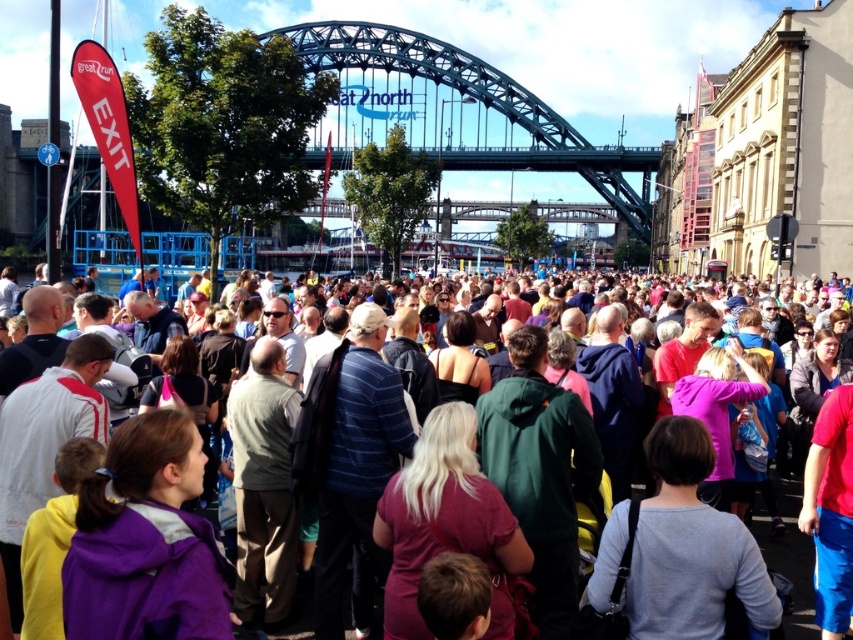
You are a photographer positioned at the edge of the event area. You want to take a photo that includes both the green steel bridge at center and the multicolored clothing at center. Which object should you focus on first to ensure both are in frame?

The green steel bridge at center is further to the viewer than the multicolored clothing at center, so you should focus on the multicolored clothing at center first to ensure both are in frame.

You are standing at the starting line of the Great North Run event and see the green steel bridge at center in the distance. If you need to reach the bridge within 10 minutes, what is the minimum average speed you must maintain?

The distance between you and the green steel bridge at center is 556.76 feet. To cover this distance in 10 minutes, you would need to maintain an average speed of approximately 55.676 feet per minute, which is roughly 0.928 feet per second or about 0.636 miles per hour.